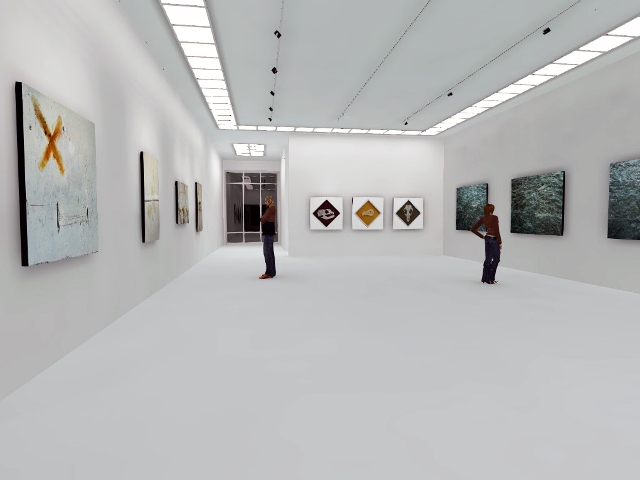
The width and height of the screenshot is (640, 480). In order to click on white floor in this screenshot , I will do `click(349, 311)`.